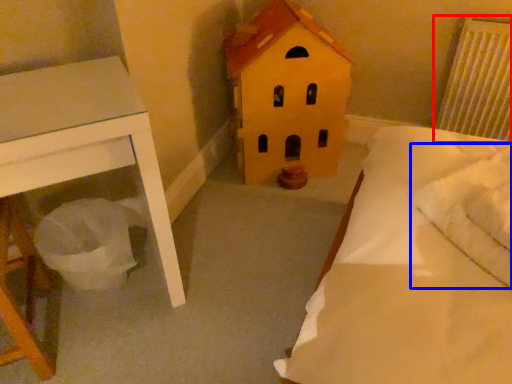
Question: Which of the following is the closest to the observer, radiator (highlighted by a red box) or pillow (highlighted by a blue box)?

Choices:
 (A) radiator
 (B) pillow

Answer: (B)